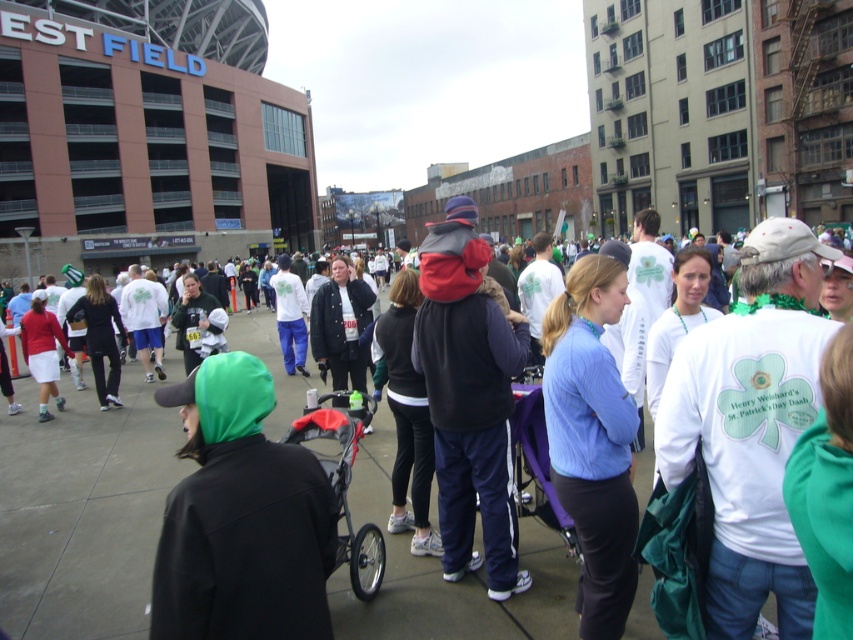
Question: Can you confirm if matte black jacket at center is positioned to the right of dark blue fleece vest at center?

Choices:
 (A) no
 (B) yes

Answer: (A)

Question: Among these points, which one is farthest from the camera?

Choices:
 (A) (189, 573)
 (B) (347, 550)
 (C) (485, 484)
 (D) (525, 627)

Answer: (C)

Question: Does dark blue fleece vest at center appear under red plastic baby carriage at center?

Choices:
 (A) yes
 (B) no

Answer: (B)

Question: Which of the following is the farthest from the observer?

Choices:
 (A) red plastic baby carriage at center
 (B) green matte hood at center
 (C) blue fleece jacket at center
 (D) matte black jacket at center

Answer: (D)

Question: Which point appears farthest from the camera in this image?

Choices:
 (A) (483, 504)
 (B) (331, 465)

Answer: (A)

Question: Can you confirm if matte black jacket at center is bigger than green matte hood at center?

Choices:
 (A) yes
 (B) no

Answer: (A)